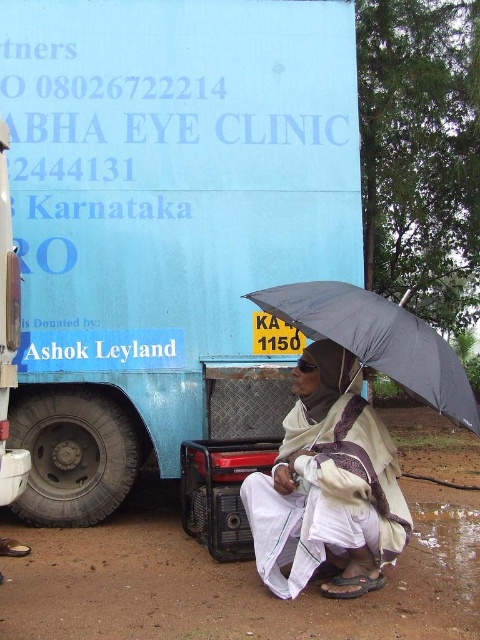
You are a delivery person who needs to place a package between the blue matte truck at center and the white cotton robe at lower center. The package requires a space of 1.5 meters. Can you fit it there?

The blue matte truck at center is 1.67 meters from the white cotton robe at lower center. Since the required space is 1.5 meters, the package can fit between them as the distance is sufficient.

You are a photographer trying to capture both the white cotton robe at lower center and the black matte umbrella at lower right in a single frame. Since the camera can only focus on one object at a time, which object should you choose to ensure the other remains in the background? Explain your reasoning based on their sizes.

The white cotton robe at lower center is smaller than the black matte umbrella at lower right. To ensure the other object remains in the background, focus on the larger object, the black matte umbrella at lower right. This way, the smaller white cotton robe at lower center will naturally appear in the background due to its smaller size and positioning.